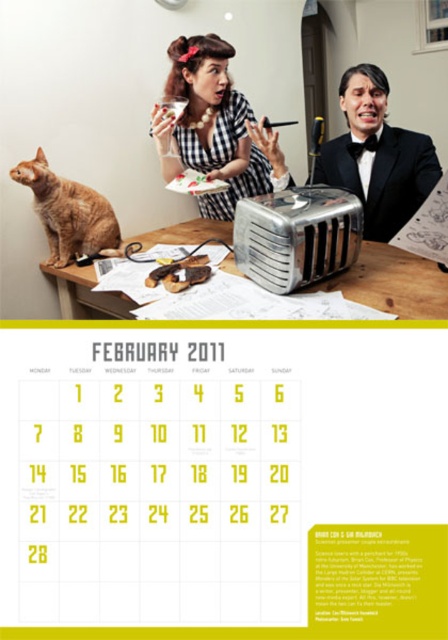
Question: Does orange fur cat at left have a lesser width compared to brown crispy bread at center?

Choices:
 (A) no
 (B) yes

Answer: (A)

Question: Does glossy black dress at center come in front of silver metallic toaster at center?

Choices:
 (A) yes
 (B) no

Answer: (B)

Question: Among these points, which one is farthest from the camera?

Choices:
 (A) (410, 150)
 (B) (245, 273)
 (C) (215, 218)

Answer: (C)

Question: Among these objects, which one is nearest to the camera?

Choices:
 (A) brown wooden table at center
 (B) brown crispy bread at center
 (C) silver metallic toaster at center

Answer: (A)

Question: Based on their relative distances, which object is nearer to the orange fur cat at left?

Choices:
 (A) glossy black dress at center
 (B) brown crispy bread at center
 (C) silver metallic toaster at center
 (D) brown wooden table at center

Answer: (B)

Question: Is orange fur cat at left closer to camera compared to brown crispy bread at center?

Choices:
 (A) yes
 (B) no

Answer: (B)